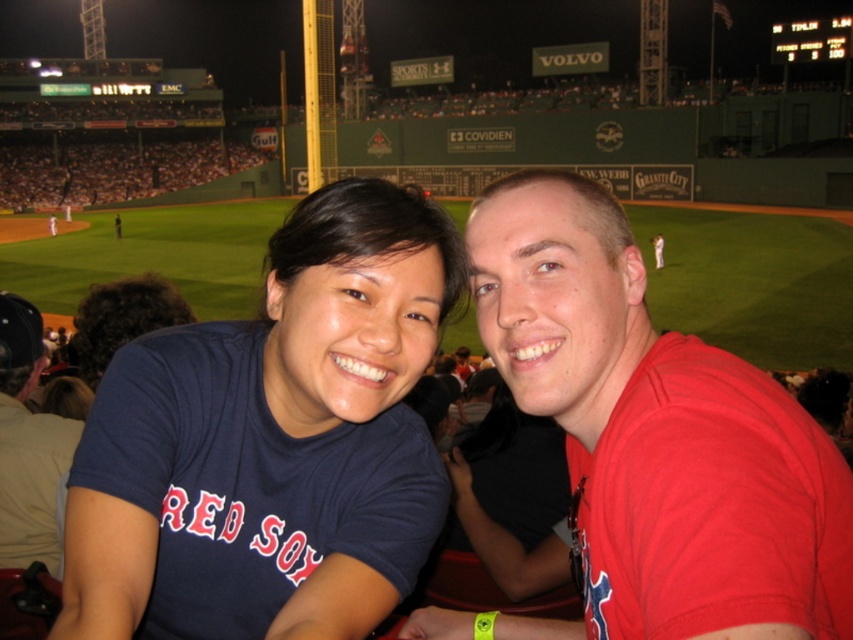
In the scene shown: You are a photographer at the baseball stadium and want to capture a photo of both the red matte shirt at center and the matte blue shirt at center. Which shirt should you focus on first to ensure both are in the frame?

The red matte shirt at center is positioned over the matte blue shirt at center, so you should focus on the red matte shirt at center first to ensure both are in the frame.

You are a photographer at the baseball stadium and want to capture a photo of the two fans wearing the red matte shirt at center and the matte blue shirt at center. From the perspective of someone sitting in the stands, which shirt is positioned to the right of the other?

The red matte shirt at center is positioned to the right of the matte blue shirt at center.